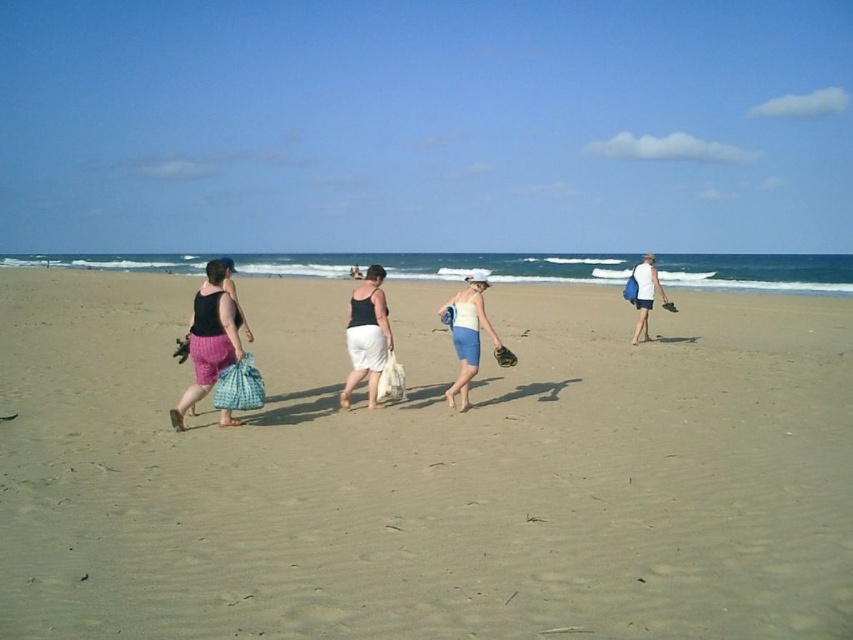
Question: Which is nearer to the brown leather glove at lower left?

Choices:
 (A) matte pink shorts at left
 (B) brown leather baseball glove at center-right

Answer: (A)

Question: Which point is farther from the camera taking this photo?

Choices:
 (A) (508, 365)
 (B) (184, 349)

Answer: (A)

Question: Based on their relative distances, which object is farther from the white fabric shorts at right?

Choices:
 (A) matte black tank top at center
 (B) brown leather glove at center
 (C) brown leather baseball glove at center-right

Answer: (A)

Question: Does light brown sand at center appear on the right side of matte white tank top at center?

Choices:
 (A) yes
 (B) no

Answer: (A)

Question: Can you confirm if matte black tank top at center is smaller than brown leather baseball glove at center-right?

Choices:
 (A) no
 (B) yes

Answer: (B)

Question: Does matte pink shorts at left have a larger size compared to brown leather glove at center?

Choices:
 (A) yes
 (B) no

Answer: (A)